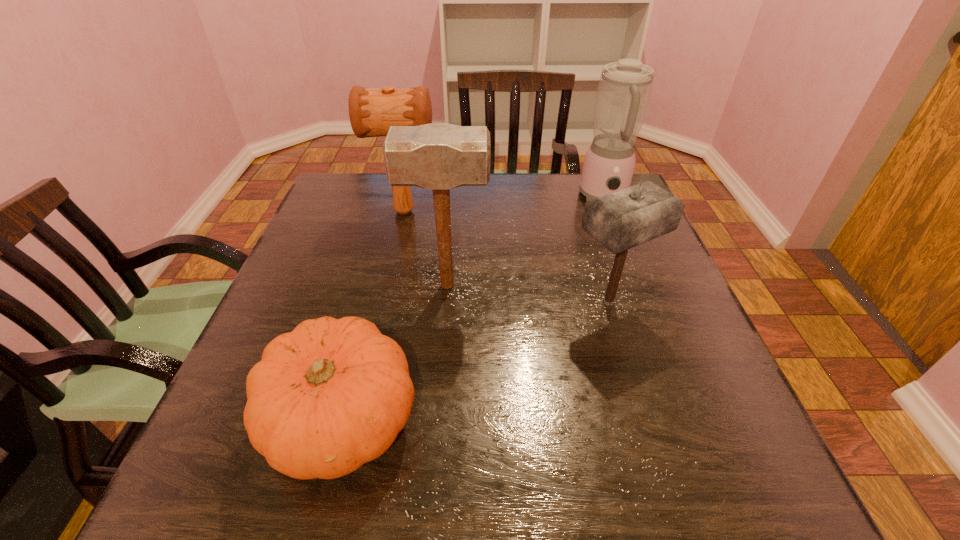
Identify which object is the closest to the shortest object. Please provide its 2D coordinates. Your answer should be formatted as a tuple, i.e. [(x, y)], where the tuple contains the x and y coordinates of a point satisfying the conditions above.

[(440, 157)]

Find the location of `object that can be found as the third closest to the nearest object`. object that can be found as the third closest to the nearest object is located at coordinates (372, 111).

At what (x,y) coordinates should I click in order to perform the action: click on mallet that can be found as the closest to the food processor. Please return your answer as a coordinate pair (x, y). Looking at the image, I should click on (621, 220).

I want to click on the closest mallet to the nearest object, so click(x=440, y=157).

Where is `vacant region that satisfies the following two spatial constraints: 1. on the base of the food processor near the control knob; 2. on the strike surface of the farthest mallet`? This screenshot has height=540, width=960. vacant region that satisfies the following two spatial constraints: 1. on the base of the food processor near the control knob; 2. on the strike surface of the farthest mallet is located at coordinates (610, 212).

Locate an element on the screen. vacant point that satisfies the following two spatial constraints: 1. on the back side of the shortest object; 2. on the right side of the rightmost mallet is located at coordinates (372, 302).